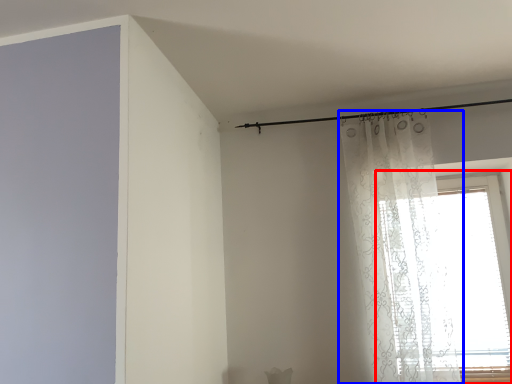
Question: Which object is closer to the camera taking this photo, window (highlighted by a red box) or curtain (highlighted by a blue box)?

Choices:
 (A) window
 (B) curtain

Answer: (B)